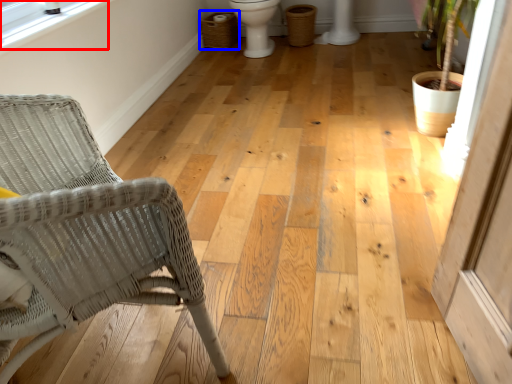
Question: Which object appears closest to the camera in this image, window screen (highlighted by a red box) or laundry basket (highlighted by a blue box)?

Choices:
 (A) window screen
 (B) laundry basket

Answer: (A)